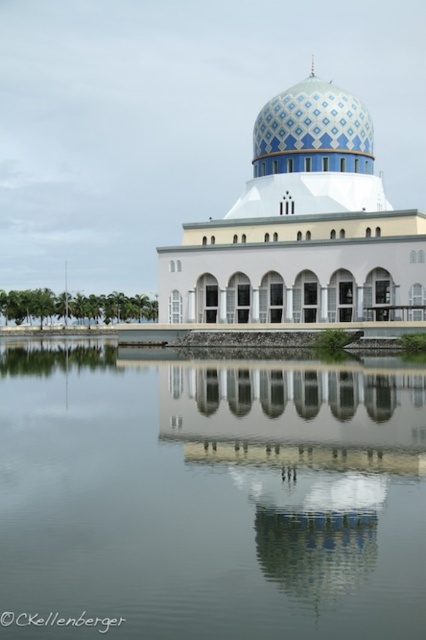
You are standing in front of the mosque and notice the transparent glass water at center and the blue glossy dome at center. Which object is located lower in the scene?

The transparent glass water at center is located below the blue glossy dome at center, so it is lower in the scene.

You are an architect evaluating the reflection of the mosque in the water. Based on the scene, which object between the transparent glass water at center and the blue mosaic dome at center appears taller in the reflection?

The blue mosaic dome at center appears taller in the reflection because the transparent glass water at center is shorter than it.